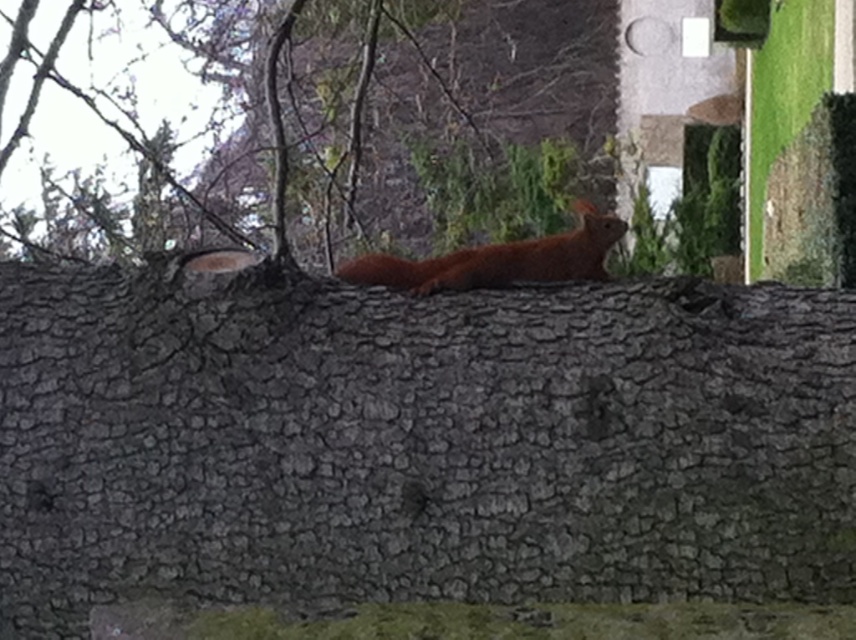
Question: Is cracked bark tree trunk at center to the right of shiny reddish-brown squirrel at center from the viewer's perspective?

Choices:
 (A) yes
 (B) no

Answer: (B)

Question: Which point is farther to the camera?

Choices:
 (A) (810, 376)
 (B) (520, 250)

Answer: (B)

Question: From the image, what is the correct spatial relationship of cracked bark tree trunk at center in relation to shiny reddish-brown squirrel at center?

Choices:
 (A) below
 (B) above

Answer: (A)

Question: Which of the following is the farthest from the observer?

Choices:
 (A) cracked bark tree trunk at center
 (B) shiny reddish-brown squirrel at center

Answer: (B)

Question: Is cracked bark tree trunk at center closer to camera compared to shiny reddish-brown squirrel at center?

Choices:
 (A) yes
 (B) no

Answer: (A)

Question: Which point appears farthest from the camera in this image?

Choices:
 (A) (738, 312)
 (B) (462, 253)

Answer: (B)